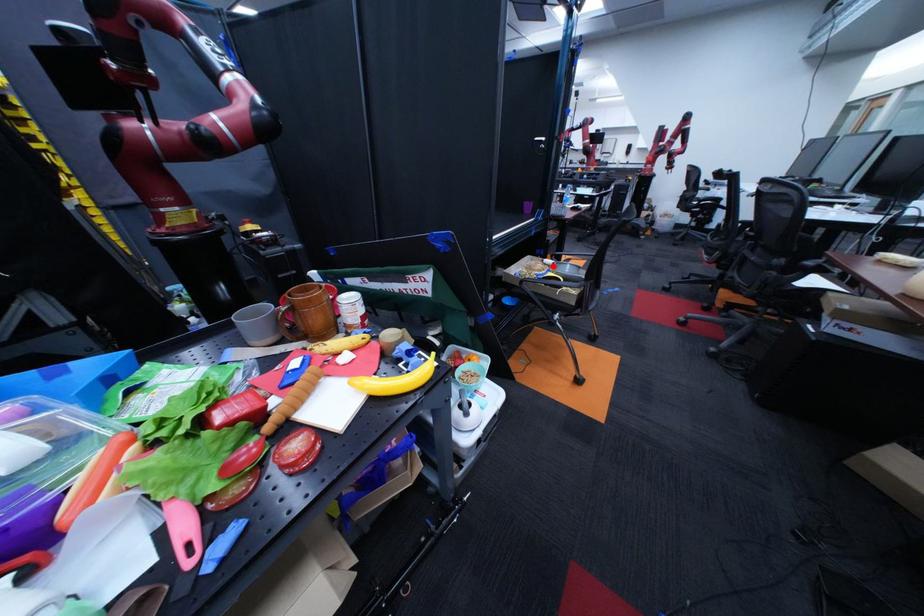
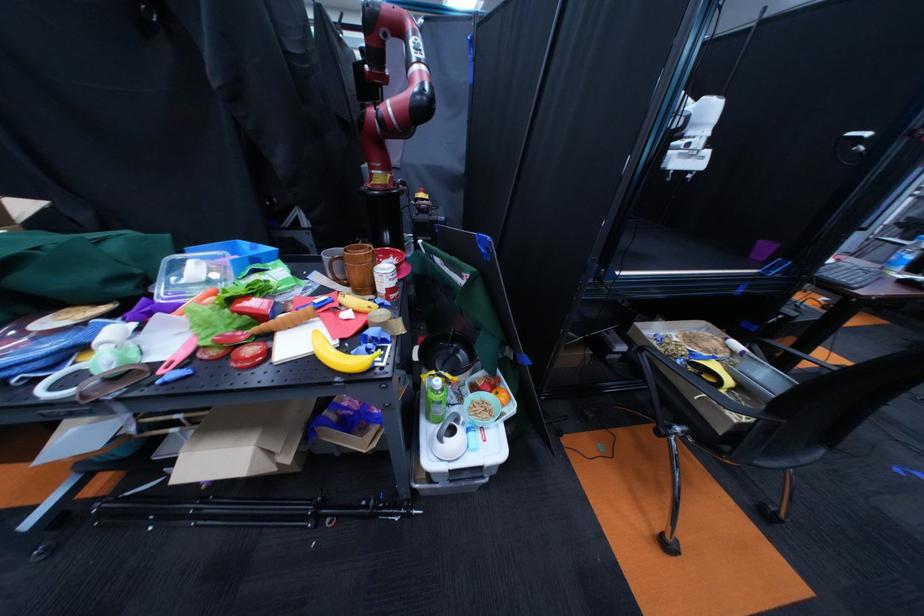
Locate, in the second image, the point that corresponds to the highlighted location in the first image.

(728, 344)